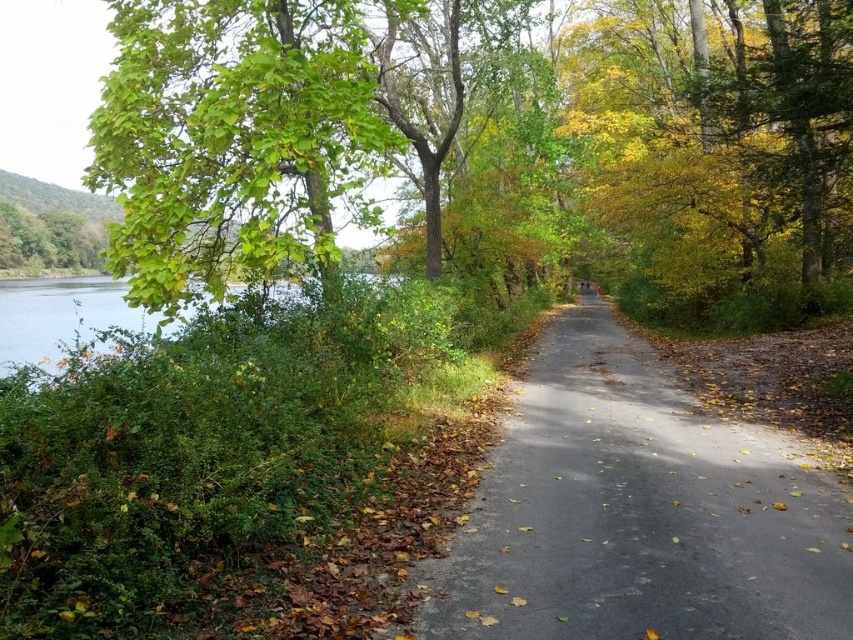
You are a hiker who wants to take a photo of the green leafy tree at upper left and the clear water at left. Since your camera can only focus on one object at a time, which object should you choose to ensure it fills the frame more? Please explain your reasoning based on their sizes.

The green leafy tree at upper left is larger in size than the clear water at left, so you should choose the green leafy tree at upper left to fill the frame more.

You are a gardener planning to trim the green leafy tree at upper left and the gray asphalt road at center. Which object requires more attention to avoid blocking the road? Please consider their widths as per the scene description.

The green leafy tree at upper left might be wider than the gray asphalt road at center, so it requires more attention to avoid blocking the road.

You are standing on the paved path in the outdoor scene. You see two points marked on the path. The first point is at coordinate point (622, 420) and the second point is at coordinate point (97, 316). If you are facing the direction the path is going, which point is closer to you?

Point (622, 420) is in front of point (97, 316), so the point closer to you is point (622, 420).